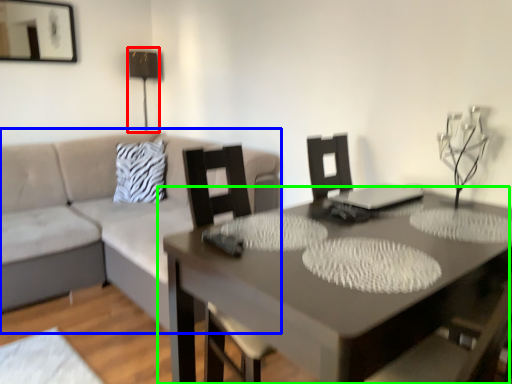
Question: Based on their relative distances, which object is farther from table lamp (highlighted by a red box)? Choose from studio couch (highlighted by a blue box) and table (highlighted by a green box).

Choices:
 (A) studio couch
 (B) table

Answer: (B)